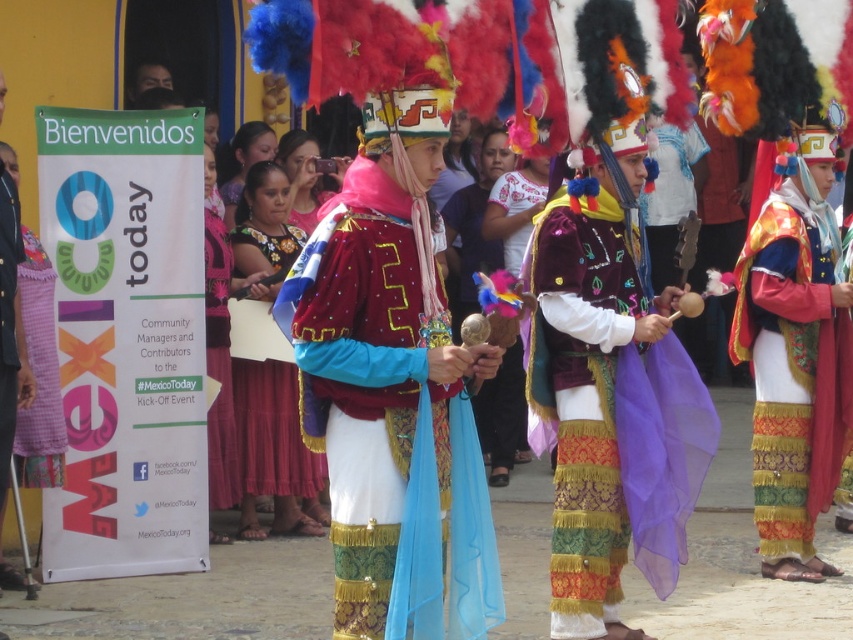
Question: Is velvet maroon vest at center above pink checkered fabric at left?

Choices:
 (A) no
 (B) yes

Answer: (A)

Question: Does shiny velvet vest at center appear on the right side of velvet maroon vest at center?

Choices:
 (A) yes
 (B) no

Answer: (B)

Question: Can you confirm if embroidered silk skirt at right is wider than shiny blue fabric at center?

Choices:
 (A) no
 (B) yes

Answer: (B)

Question: Among these points, which one is farthest from the camera?

Choices:
 (A) (13, 248)
 (B) (210, 266)
 (C) (410, 204)

Answer: (B)

Question: Considering the real-world distances, which object is closest to the embroidered silk skirt at right?

Choices:
 (A) shiny gold jacket at center
 (B) velvet maroon vest at center
 (C) matte pink fabric at center
 (D) shiny velvet vest at center

Answer: (B)

Question: Which of the following is the closest to the observer?

Choices:
 (A) embroidered silk skirt at right
 (B) shiny gold jacket at center

Answer: (B)